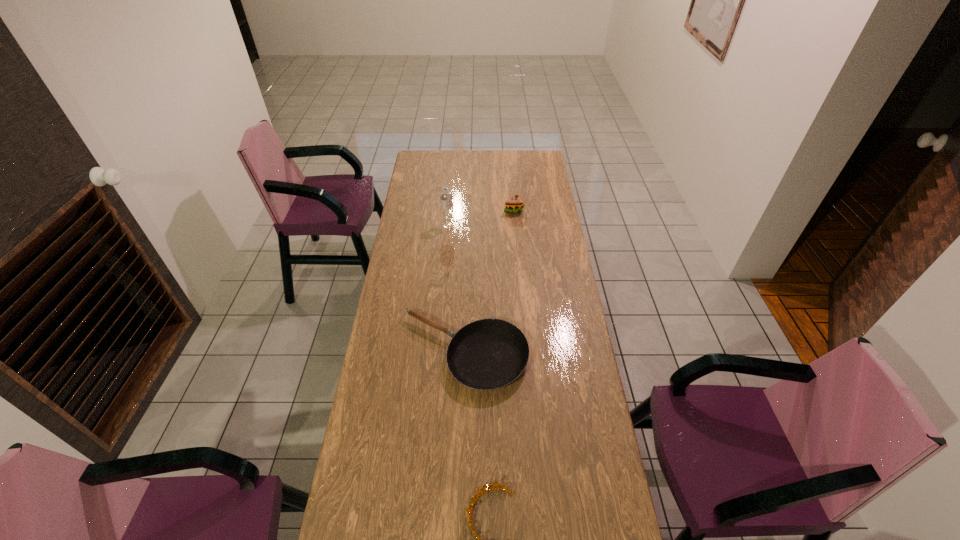
You are a GUI agent. You are given a task and a screenshot of the screen. Output one action in this format:
    pyautogui.click(x=<x>, y=<y>)
    Task: Click on the free spot at the far edge of the desktop
    
    Given the screenshot: What is the action you would take?
    pyautogui.click(x=507, y=157)

You are a GUI agent. You are given a task and a screenshot of the screen. Output one action in this format:
    pyautogui.click(x=<x>, y=<y>)
    Task: Click on the vacant space at the left edge
    This screenshot has height=540, width=960.
    Given the screenshot: What is the action you would take?
    click(389, 316)

Image resolution: width=960 pixels, height=540 pixels. Identify the location of free space at the right edge of the desktop. (573, 431).

Locate an element on the screen. This screenshot has width=960, height=540. vacant space that is in between the tallest object and the frying pan is located at coordinates (456, 289).

Image resolution: width=960 pixels, height=540 pixels. I want to click on blank region between the sandwich and the second farthest object, so click(481, 218).

At what (x,y) coordinates should I click in order to perform the action: click on unoccupied area between the frying pan and the sandwich. Please return your answer as a coordinate pair (x, y). Looking at the image, I should click on (489, 281).

Locate an element on the screen. This screenshot has height=540, width=960. free space between the sandwich and the tallest object is located at coordinates pos(481,218).

Find the location of `empty space between the water bottle and the second nearest object`. empty space between the water bottle and the second nearest object is located at coordinates (456, 289).

You are a GUI agent. You are given a task and a screenshot of the screen. Output one action in this format:
    pyautogui.click(x=<x>, y=<y>)
    Task: Click on the free space between the third nearest object and the shortest object
    The width and height of the screenshot is (960, 540).
    Given the screenshot: What is the action you would take?
    pyautogui.click(x=456, y=289)

Image resolution: width=960 pixels, height=540 pixels. I want to click on free spot between the second nearest object and the third nearest object, so click(456, 289).